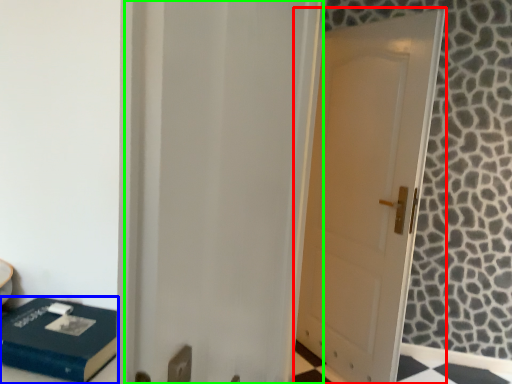
Question: Which object is positioned closest to door (highlighted by a red box)? Select from box (highlighted by a blue box) and screen door (highlighted by a green box).

Choices:
 (A) box
 (B) screen door

Answer: (B)